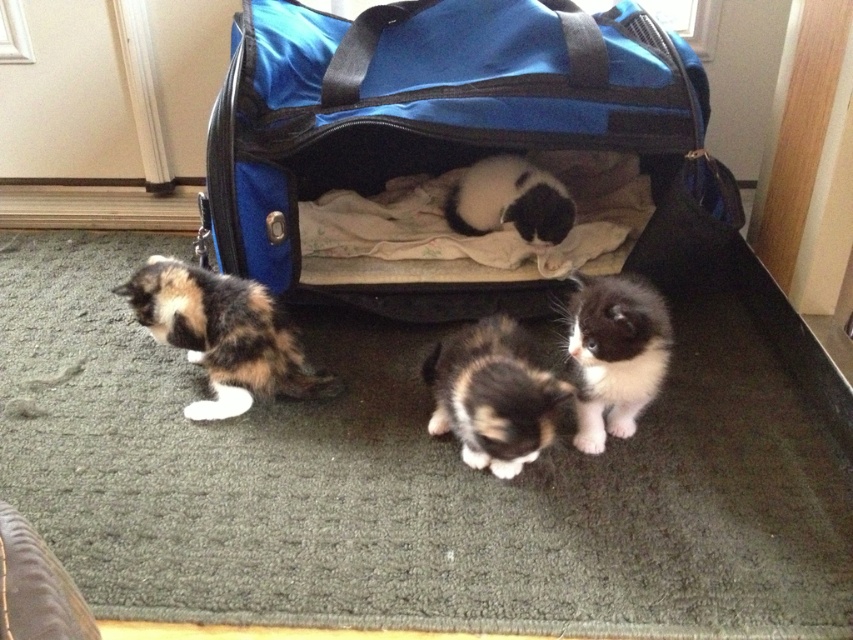
Image resolution: width=853 pixels, height=640 pixels. What are the coordinates of `blue fabric bag at center` in the screenshot? It's located at (457, 150).

Does blue fabric bag at center lie behind black fluffy cat at center?

Yes, it is.

Is point (341, 152) positioned in front of point (579, 417)?

No, (341, 152) is further to viewer.

Image resolution: width=853 pixels, height=640 pixels. I want to click on blue fabric bag at center, so coord(457,150).

Is calico fur kitten at center to the right of black and white fur cat at center from the viewer's perspective?

In fact, calico fur kitten at center is to the left of black and white fur cat at center.

Who is more distant from viewer, (494,372) or (511,163)?

Point (511,163)

Where is `calico fur kitten at center`? calico fur kitten at center is located at coordinates (492, 396).

The height and width of the screenshot is (640, 853). I want to click on calico fur cat at left, so click(x=222, y=333).

Does point (149, 324) come farther from viewer compared to point (471, 328)?

Yes, point (149, 324) is behind point (471, 328).

This screenshot has height=640, width=853. In order to click on calico fur cat at left in this screenshot , I will do `click(222, 333)`.